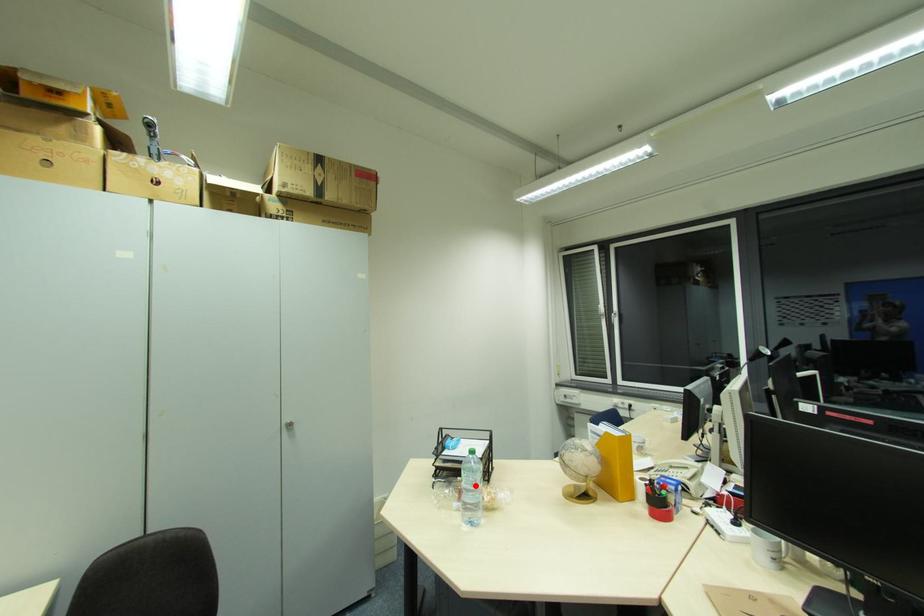
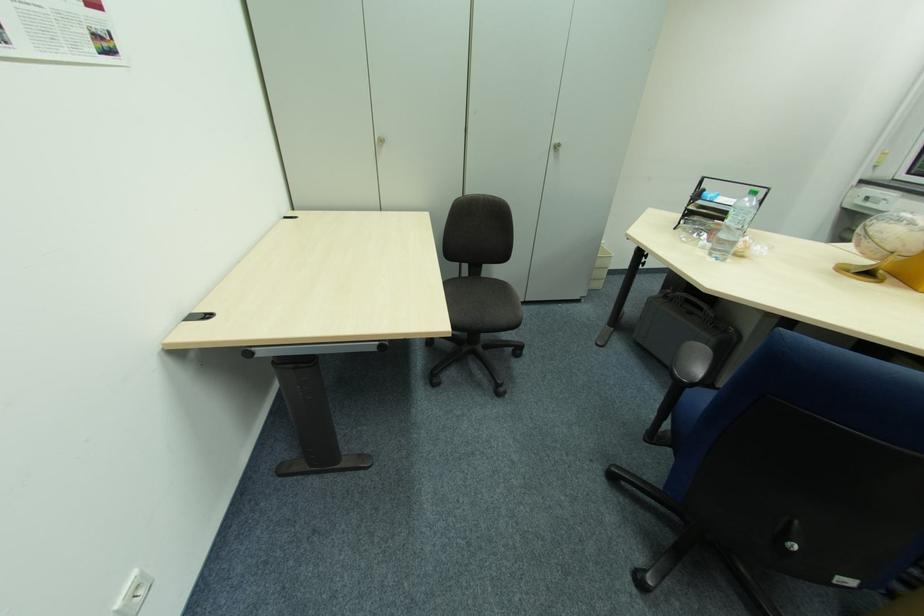
Where in the second image is the point corresponding to the highlighted location from the first image?

(743, 224)